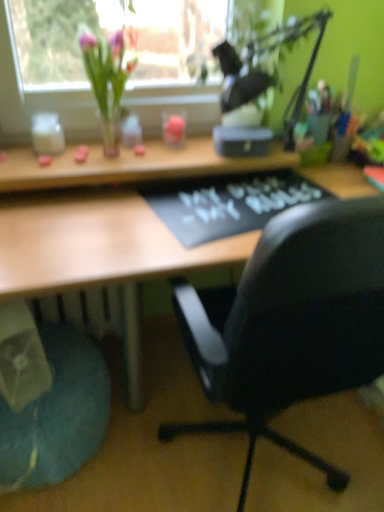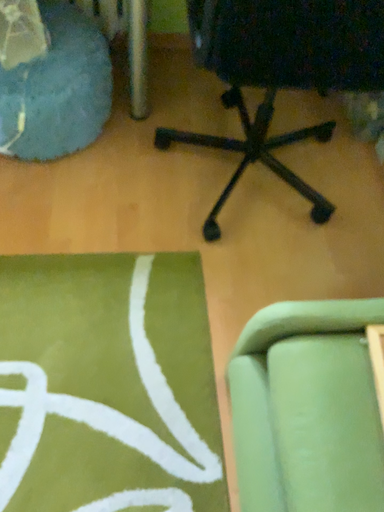
Question: How did the camera likely rotate when shooting the video?

Choices:
 (A) rotated downward
 (B) rotated upward

Answer: (A)